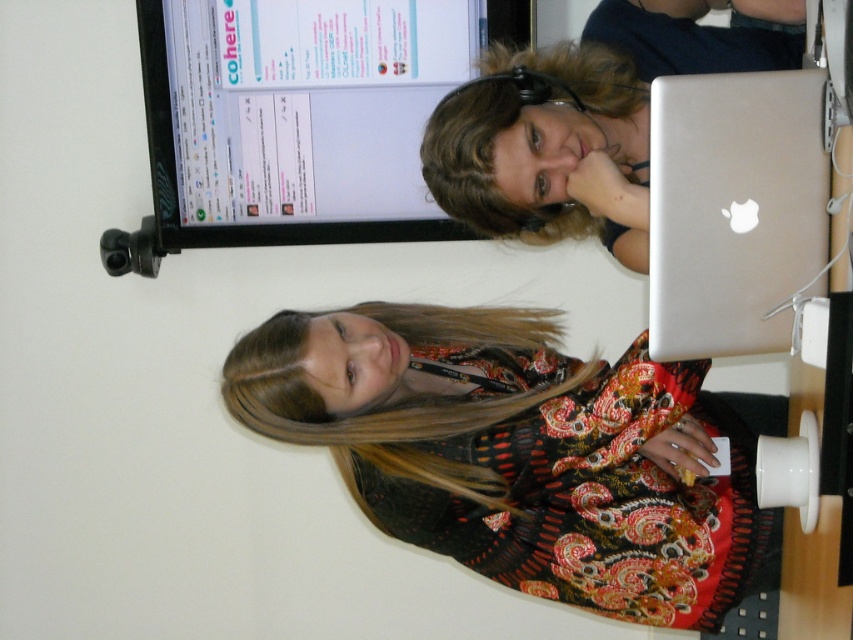
Question: Can you confirm if printed fabric dress at center is positioned below silver metallic laptop at right?

Choices:
 (A) no
 (B) yes

Answer: (B)

Question: Which of the following is the farthest from the observer?

Choices:
 (A) silver metallic laptop at right
 (B) matte black monitor at upper center

Answer: (B)

Question: Which of the following is the farthest from the observer?

Choices:
 (A) [x=363, y=236]
 (B) [x=619, y=356]
 (C) [x=804, y=289]

Answer: (A)

Question: Observing the image, what is the correct spatial positioning of printed fabric dress at center in reference to silver metallic laptop at right?

Choices:
 (A) left
 (B) right

Answer: (A)

Question: Based on their relative distances, which object is farther from the printed fabric dress at center?

Choices:
 (A) silver metallic laptop at right
 (B) matte black monitor at upper center

Answer: (B)

Question: Is matte black monitor at upper center to the right of silver metallic laptop at right from the viewer's perspective?

Choices:
 (A) no
 (B) yes

Answer: (A)